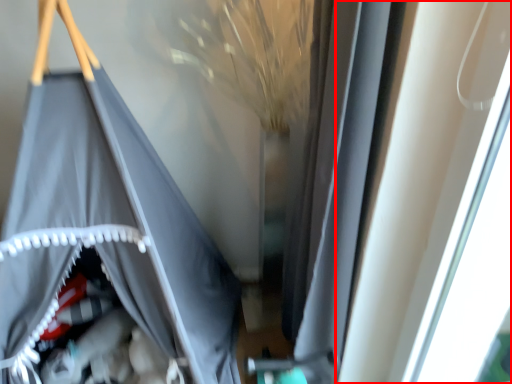
Question: From the image's perspective, what is the correct spatial positioning of window (annotated by the red box) in reference to curtain?

Choices:
 (A) above
 (B) below

Answer: (B)